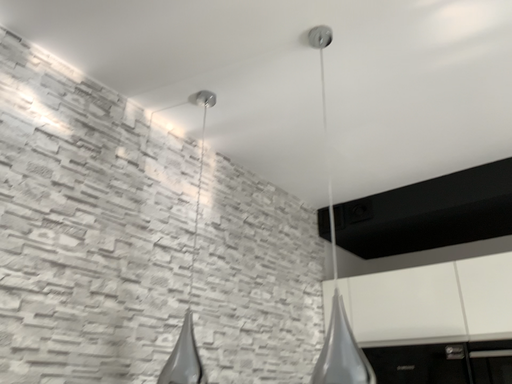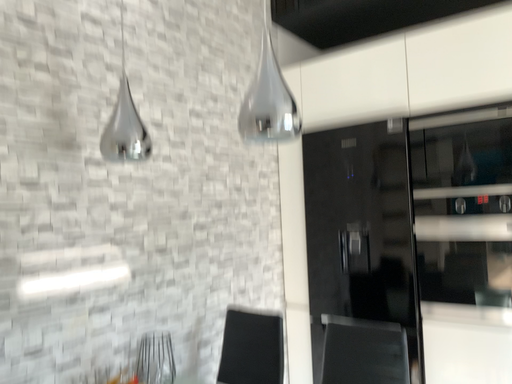
Question: Which way did the camera rotate in the video?

Choices:
 (A) rotated upward
 (B) rotated downward

Answer: (B)